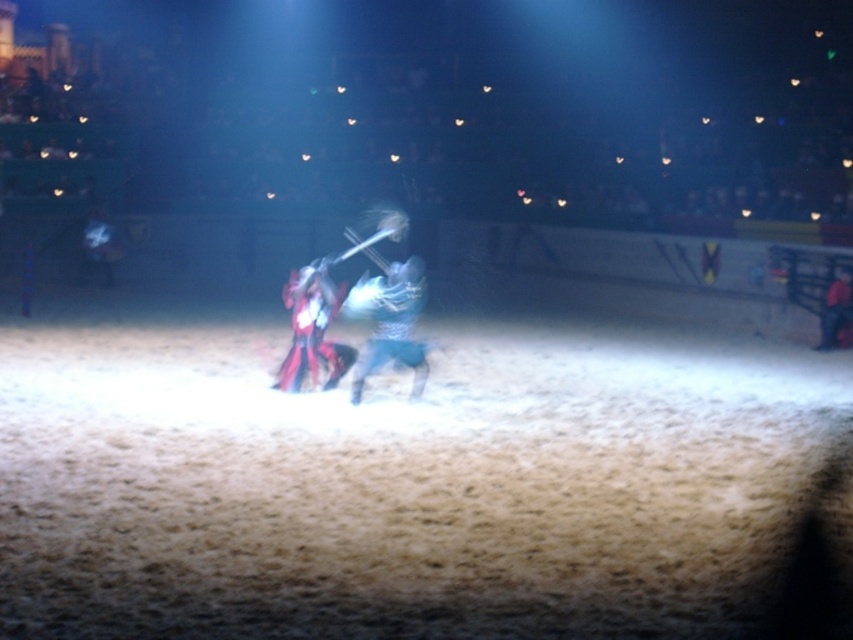
Question: Is metallic blue armor at center to the left of shiny red armor at center from the viewer's perspective?

Choices:
 (A) no
 (B) yes

Answer: (A)

Question: Which point is closer to the camera?

Choices:
 (A) (305, 296)
 (B) (367, 358)

Answer: (B)

Question: Can you confirm if metallic blue armor at center is positioned to the right of shiny red armor at center?

Choices:
 (A) no
 (B) yes

Answer: (B)

Question: Does metallic blue armor at center lie in front of shiny red armor at center?

Choices:
 (A) no
 (B) yes

Answer: (B)